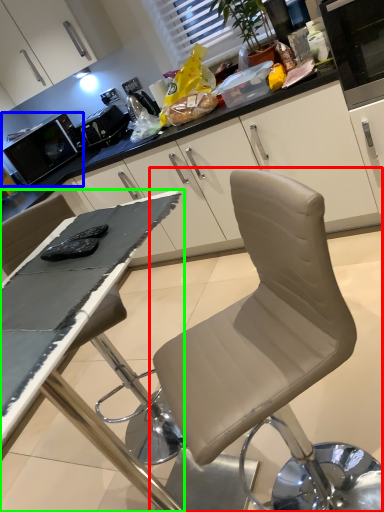
Question: Estimate the real-world distances between objects in this image. Which object is closer to chair (highlighted by a red box), appliance (highlighted by a blue box) or table (highlighted by a green box)?

Choices:
 (A) appliance
 (B) table

Answer: (B)